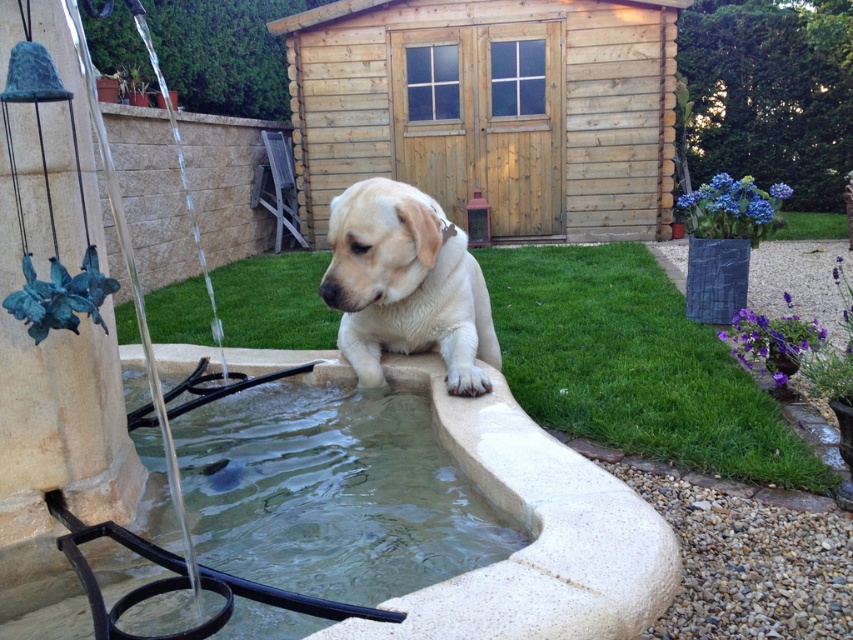
Can you confirm if clear glass water at lower center is wider than light beige fur at center?

Correct, the width of clear glass water at lower center exceeds that of light beige fur at center.

Who is more forward, [332,413] or [436,244]?

Positioned in front is point [436,244].

Locate an element on the screen. clear glass water at lower center is located at coordinates (332, 492).

Can you confirm if wooden shed at center is taller than clear glass water at lower center?

Yes.

Is wooden shed at center thinner than clear glass water at lower center?

In fact, wooden shed at center might be wider than clear glass water at lower center.

This screenshot has width=853, height=640. Identify the location of wooden shed at center. (491, 109).

Where is `wooden shed at center`? This screenshot has width=853, height=640. wooden shed at center is located at coordinates (491, 109).

Find the location of a particular element. wooden shed at center is located at coordinates (491, 109).

Identify the location of wooden shed at center. The image size is (853, 640). (491, 109).